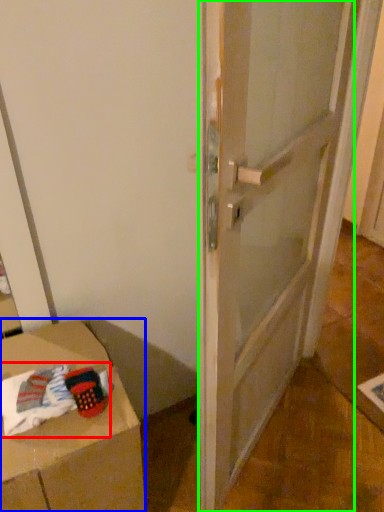
Question: Which object is the closest to the laundry (highlighted by a red box)? Choose among these: furniture (highlighted by a blue box) or door (highlighted by a green box).

Choices:
 (A) furniture
 (B) door

Answer: (A)